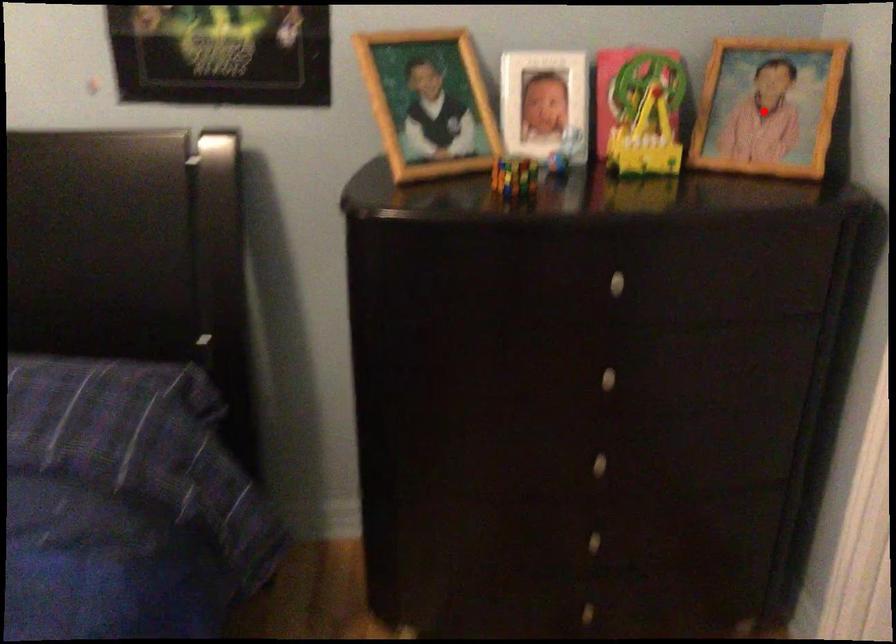
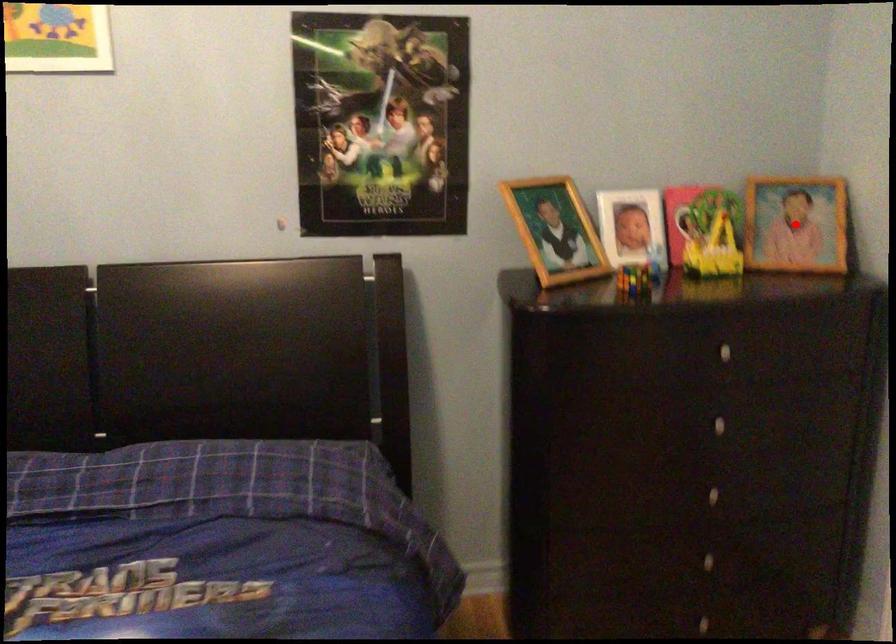
I am providing you with two images of the same scene from different viewpoints. A red point is marked on the first image and another point is marked on the second image. Are the points marked in image1 and image2 representing the same 3D position?

Yes